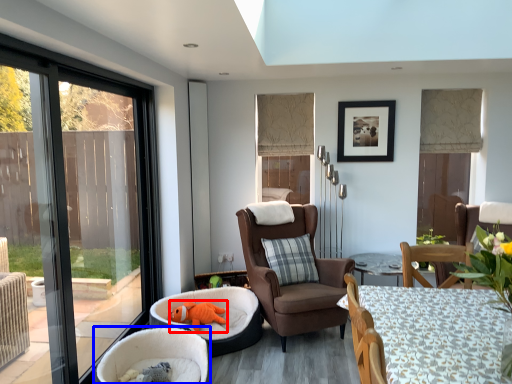
Question: Which of the following is the farthest to the observer, animal (highlighted by a red box) or chair (highlighted by a blue box)?

Choices:
 (A) animal
 (B) chair

Answer: (A)